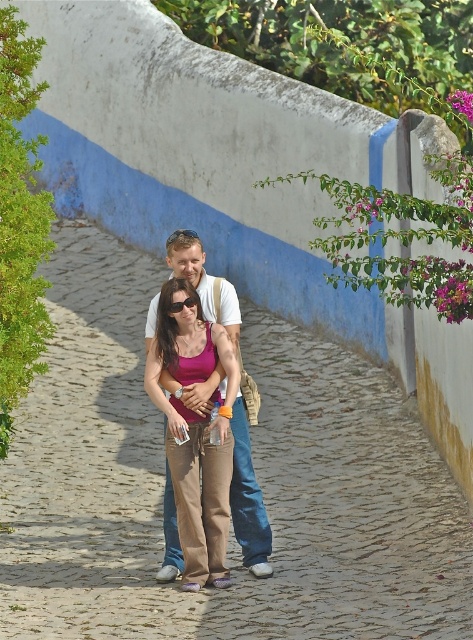
You are a photographer planning to capture the couple walking on the cobblestone path at center and wearing the white cotton shirt at center. If you want to ensure both the path and the shirt are clearly visible in your shot, which one should you focus on first to avoid blurriness?

The cobblestone path at center is bigger than the white cotton shirt at center, so focusing on the larger cobblestone path at center first would help ensure both are in focus as the shirt is smaller and might require adjusting the focus afterwards.

You are standing at the entrance of the cobblestone path at center. What are the coordinates of the path where you should step onto to continue walking?

The coordinates of the cobblestone path at center are at point (257, 477).

You are a photographer planning to take a photo of the cobblestone path at center and the white cotton shirt at center. If you want to ensure both are fully visible in the frame, which object should you focus on to avoid cropping either?

You should focus on the cobblestone path at center because its width is greater than the white cotton shirt at center, so centering the cobblestone path ensures both objects are fully visible without cropping.